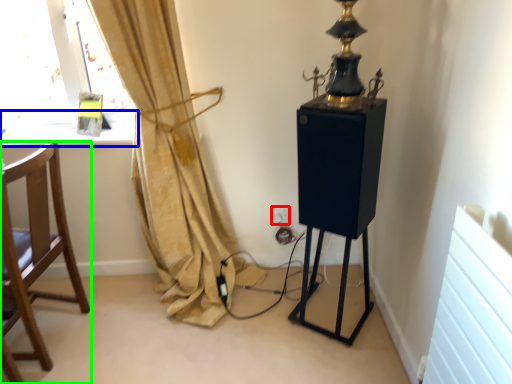
Question: Based on their relative distances, which object is farther from electric outlet (highlighted by a red box)? Choose from window sill (highlighted by a blue box) and chair (highlighted by a green box).

Choices:
 (A) window sill
 (B) chair

Answer: (B)